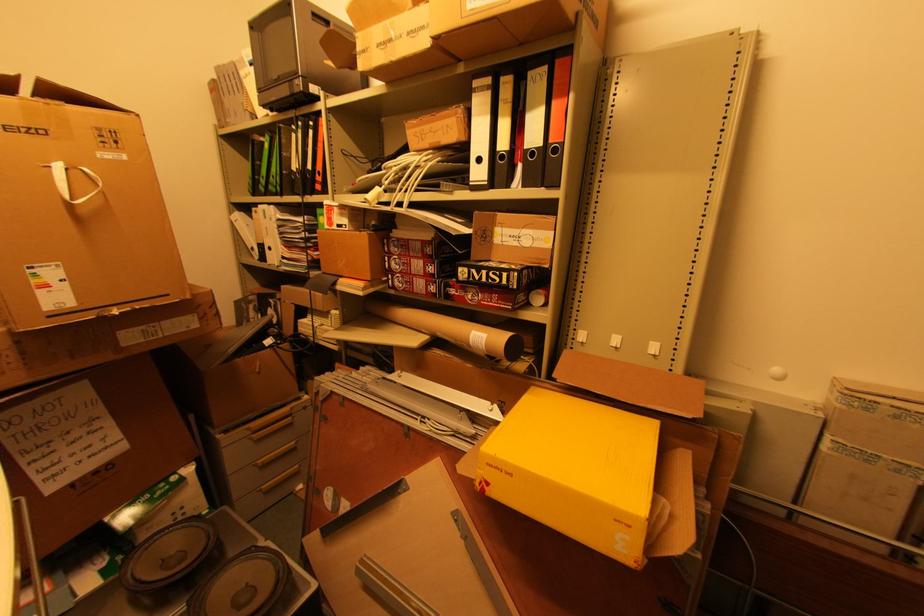
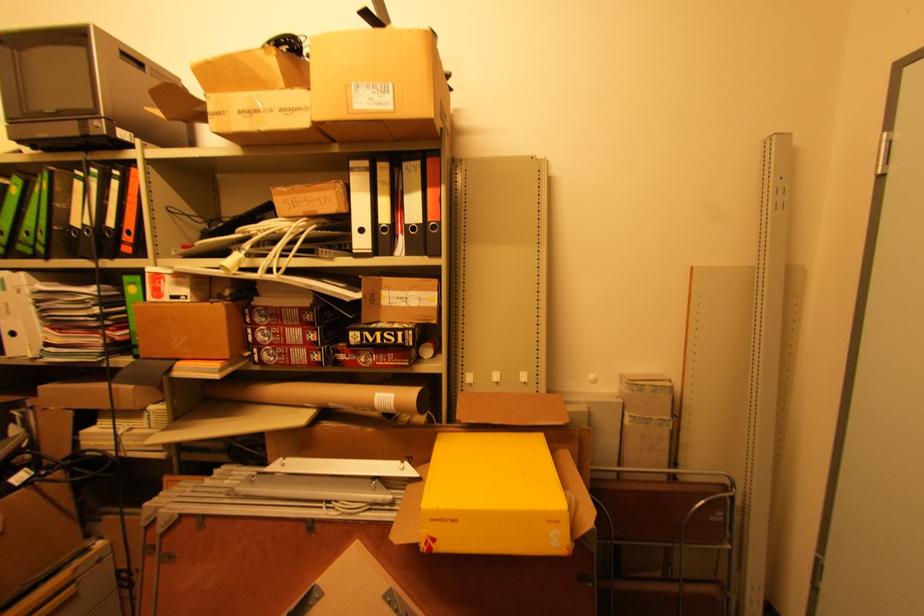
Question: The camera is either moving clockwise (left) or counter-clockwise (right) around the object. The first image is from the beginning of the video and the second image is from the end. Is the camera moving left or right when shooting the video?

Choices:
 (A) Left
 (B) Right

Answer: (A)